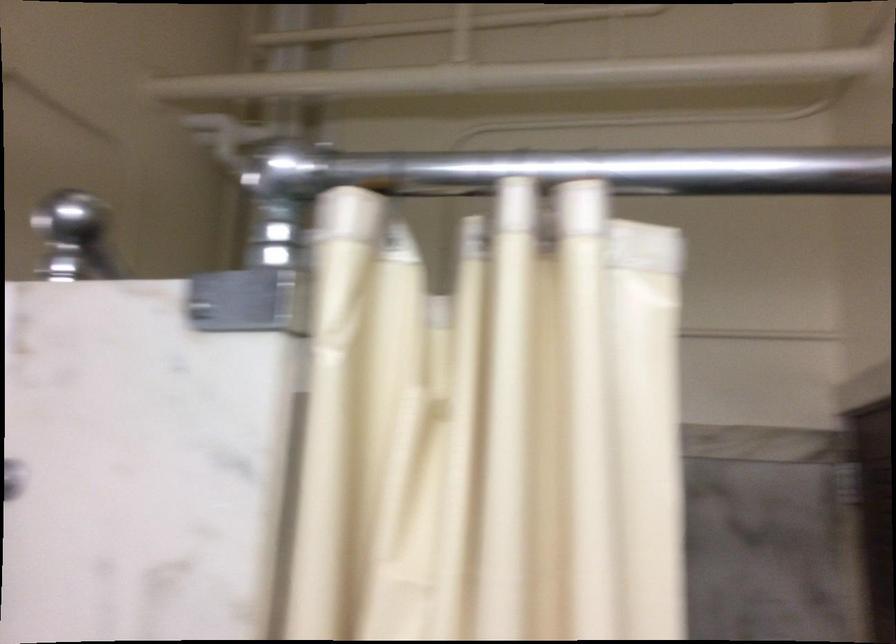
At what (x,y) coordinates should I click in order to perform the action: click on beige shower curtain. Please return your answer as a coordinate pair (x, y). The image size is (896, 644). Looking at the image, I should click on (492, 427).